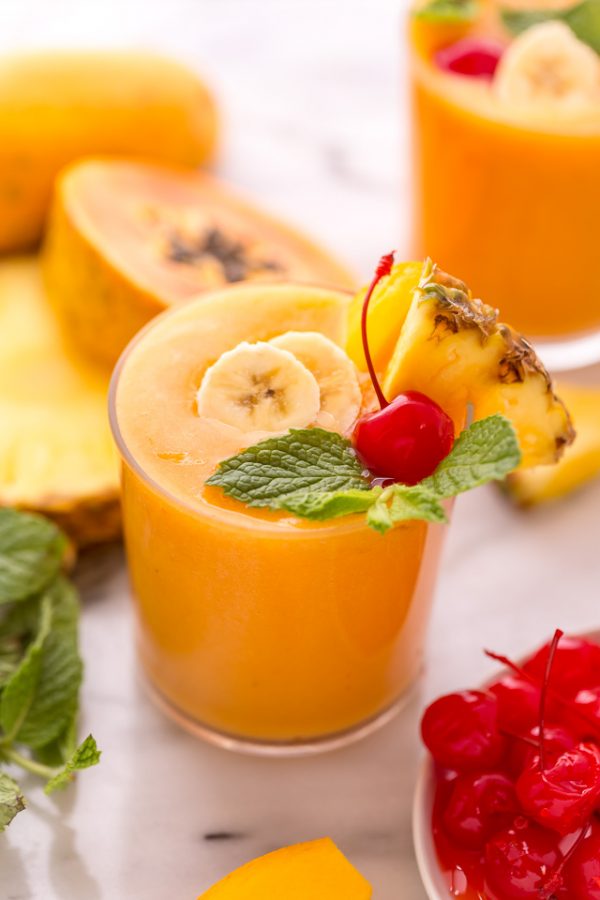
Locate an element on the screen. This screenshot has height=900, width=600. bowl filled with cherries is located at coordinates (516, 783).